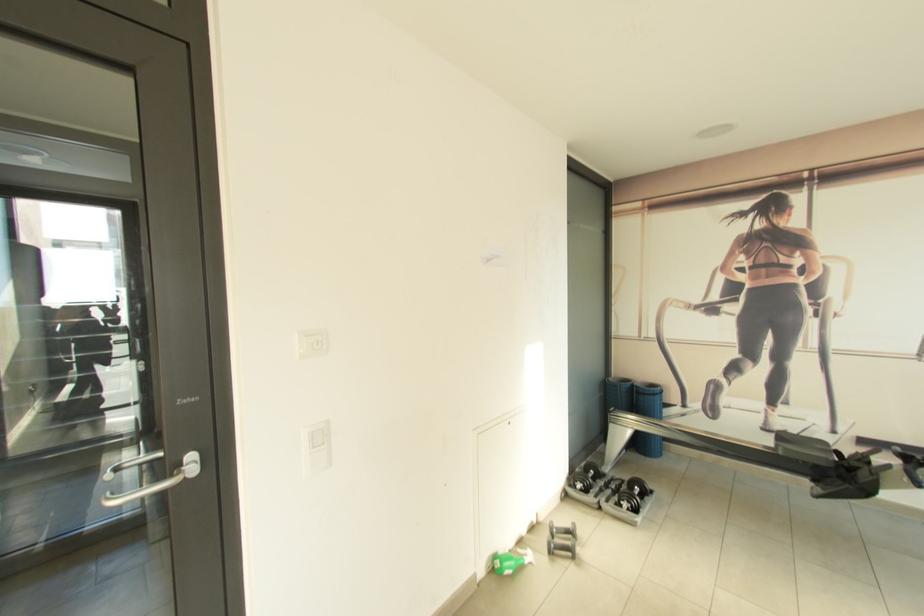
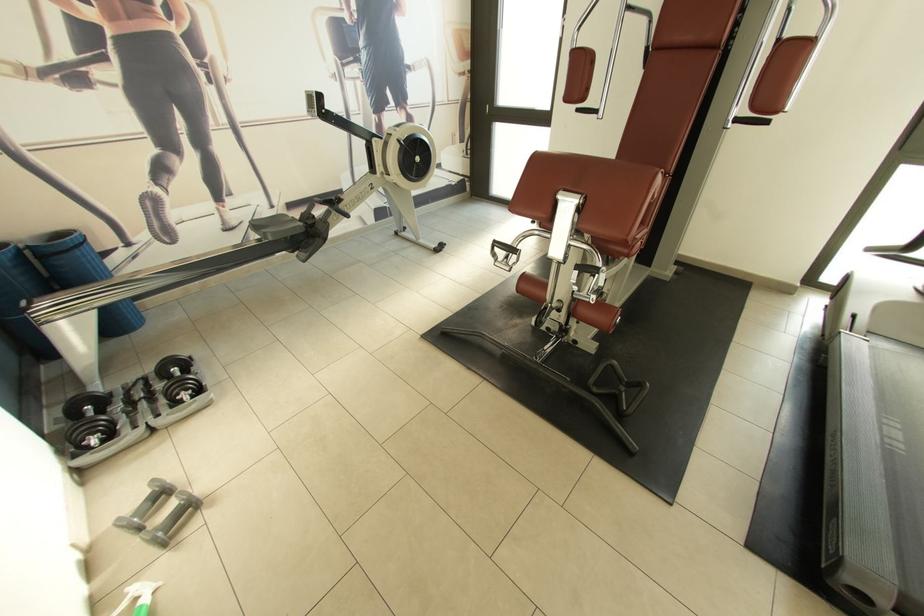
In the second image, find the point that corresponds to the point at 573,525 in the first image.

(152, 493)